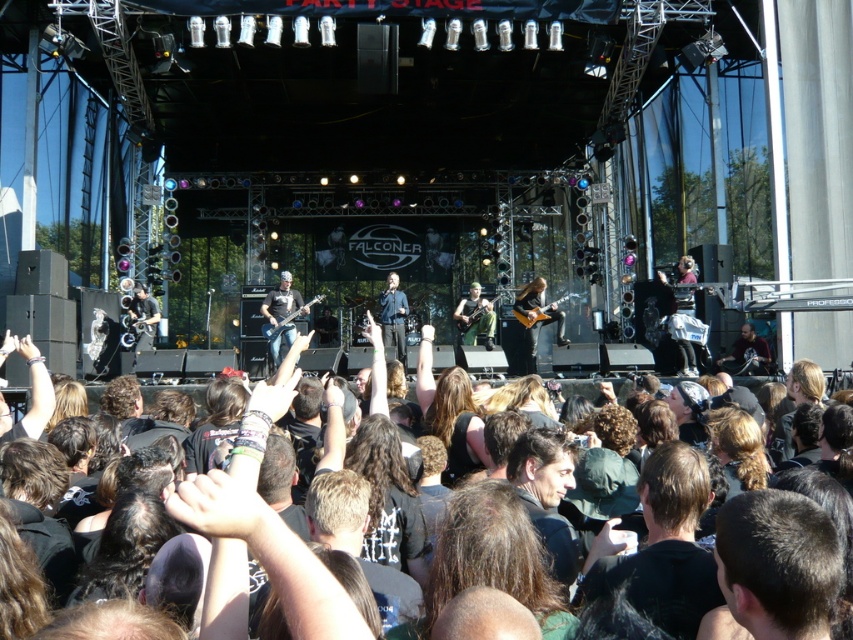
Question: Which point is closer to the camera?

Choices:
 (A) (683, 570)
 (B) (756, 509)

Answer: (B)

Question: Does black t-shirt at center appear on the left side of dark brown hair at center?

Choices:
 (A) yes
 (B) no

Answer: (A)

Question: Which of the following is the farthest from the observer?

Choices:
 (A) black t-shirt at center
 (B) dark brown hair at center

Answer: (A)

Question: Is black t-shirt at center to the left of dark brown hair at center from the viewer's perspective?

Choices:
 (A) yes
 (B) no

Answer: (A)

Question: Can you confirm if black t-shirt at center is wider than dark brown hair at center?

Choices:
 (A) yes
 (B) no

Answer: (A)